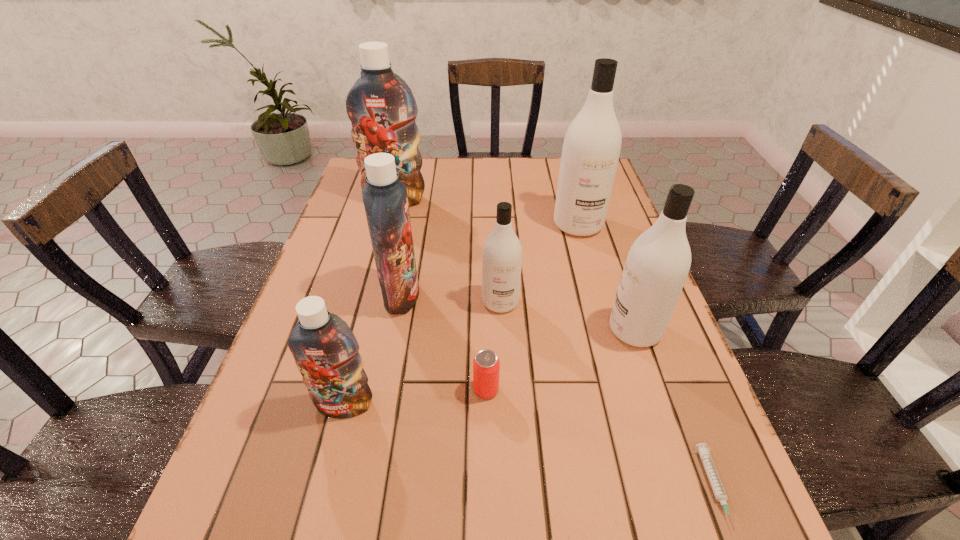
This screenshot has height=540, width=960. Identify the location of beer can. (486, 365).

At what (x,y) coordinates should I click in order to perform the action: click on the seventh tallest object. Please return your answer as a coordinate pair (x, y). Image resolution: width=960 pixels, height=540 pixels. Looking at the image, I should click on (486, 365).

Find the location of a particular element. The image size is (960, 540). syringe is located at coordinates (712, 474).

Image resolution: width=960 pixels, height=540 pixels. I want to click on the nearest object, so click(712, 474).

Identify the location of vacant space located on the front-facing side of the biggest white shampoo. This screenshot has width=960, height=540. (589, 263).

At what (x,y) coordinates should I click in order to perform the action: click on blank space located 0.230m on the front label of the farthest shampoo. Please return your answer as a coordinate pair (x, y). The image size is (960, 540). Looking at the image, I should click on (380, 258).

At what (x,y) coordinates should I click in order to perform the action: click on blank space located 0.270m on the front label of the second biggest blue shampoo. Please return your answer as a coordinate pair (x, y). This screenshot has height=540, width=960. Looking at the image, I should click on (531, 295).

Where is `free space located 0.280m on the front-facing side of the second smallest white shampoo`? The image size is (960, 540). free space located 0.280m on the front-facing side of the second smallest white shampoo is located at coordinates (484, 330).

Find the location of `free space located on the front-facing side of the second smallest white shampoo`. free space located on the front-facing side of the second smallest white shampoo is located at coordinates (484, 330).

You are a GUI agent. You are given a task and a screenshot of the screen. Output one action in this format:
    pyautogui.click(x=<x>, y=<y>)
    Task: Click on the free space located on the front-facing side of the second smallest white shampoo
    
    Given the screenshot: What is the action you would take?
    pyautogui.click(x=524, y=330)